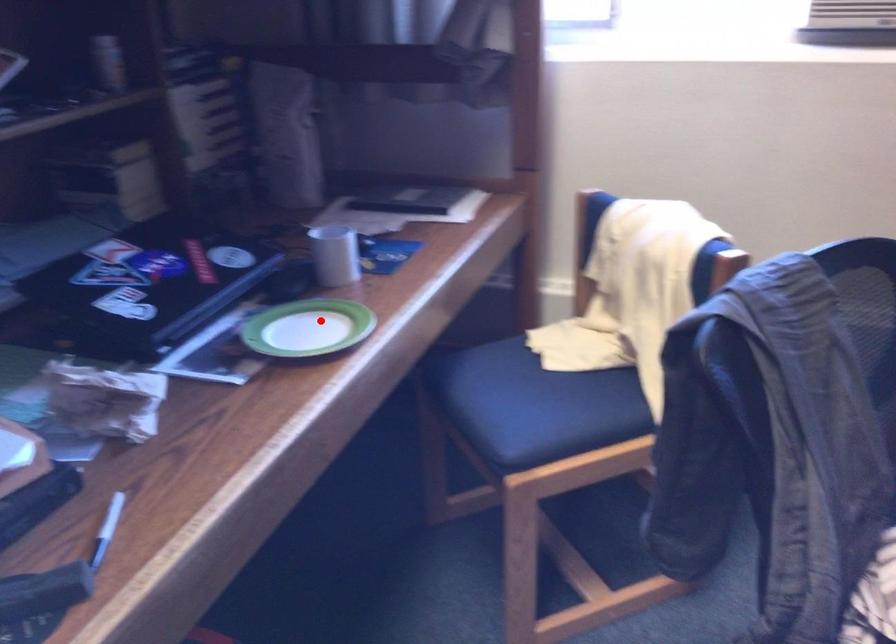
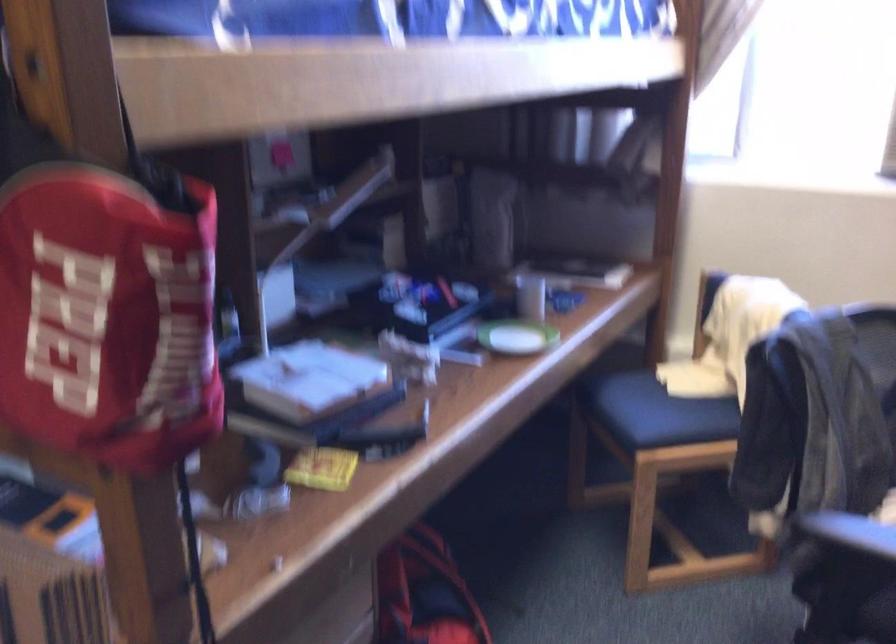
Find the pixel in the second image that matches the highlighted location in the first image.

(515, 337)